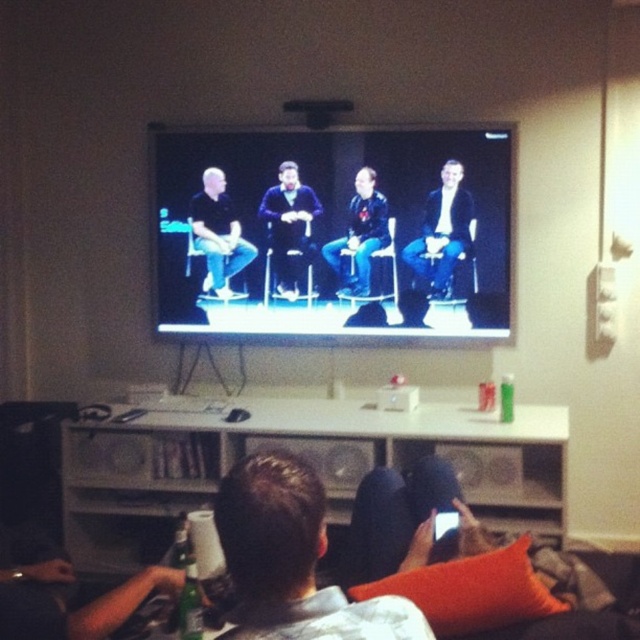
Question: Is matte black chairs at center smaller than light blue suit at center?

Choices:
 (A) yes
 (B) no

Answer: (B)

Question: Is matte black chairs at center wider than black matte shirt at center?

Choices:
 (A) no
 (B) yes

Answer: (B)

Question: Which is nearer to the dark blue leather jacket at center?

Choices:
 (A) matte black chairs at center
 (B) light blue suit at center

Answer: (A)

Question: Is the position of dark brown leather couch at lower center less distant than that of light blue suit at center?

Choices:
 (A) yes
 (B) no

Answer: (A)

Question: Which point is closer to the camera taking this photo?

Choices:
 (A) (444, 225)
 (B) (296, 586)
 (C) (364, 166)
 (D) (356, 211)

Answer: (B)

Question: Which is nearer to the light blue suit at center?

Choices:
 (A) matte black chairs at center
 (B) dark blue sweater at center
 (C) dark blue leather jacket at center
 (D) dark brown leather couch at lower center

Answer: (A)